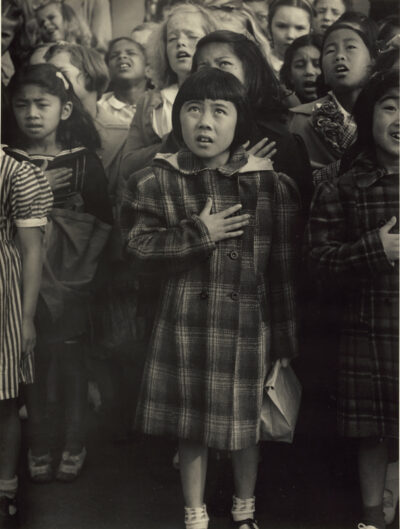
Where is `coat`? This screenshot has width=400, height=529. coat is located at coordinates (202, 373).